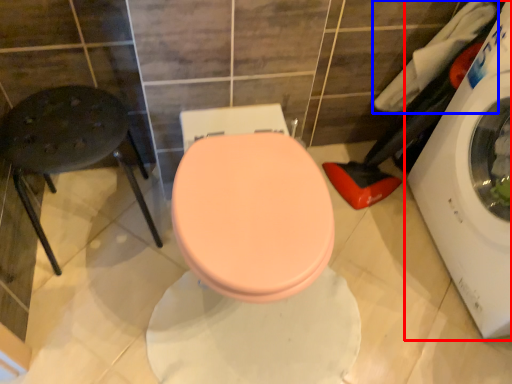
Question: Which object is further to the camera taking this photo, washing machine (highlighted by a red box) or laundry (highlighted by a blue box)?

Choices:
 (A) washing machine
 (B) laundry

Answer: (B)